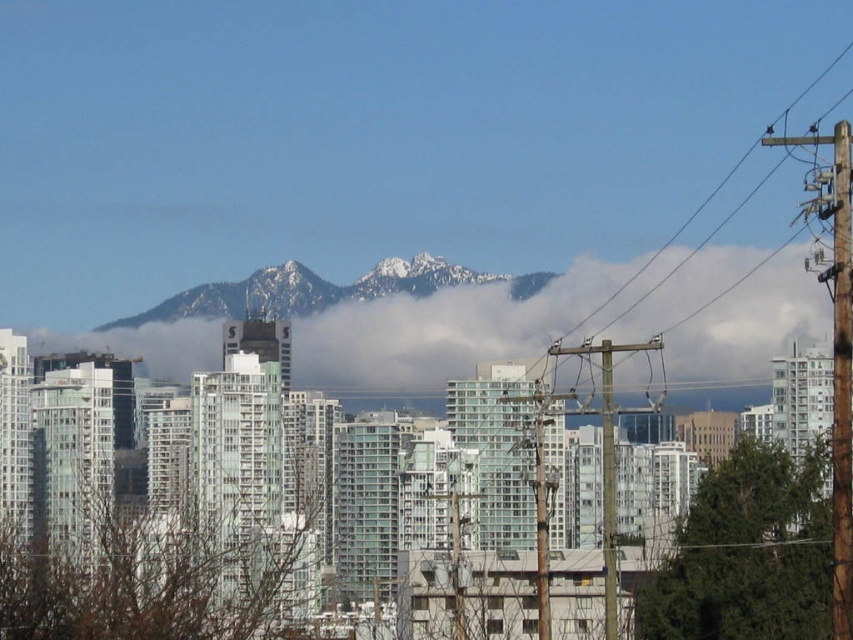
You are an architect designing a new skyscraper in this city. You want to ensure that the building doesn not block the view of the snowy rocky mountain at center from the observation deck. Given that the white fluffy cloud at center is currently obscuring part of the mountain, which object would you need to consider in your design to maintain the mountain view?

You need to consider the white fluffy cloud at center because its width is larger than the snowy rocky mountain at center, so it may block more of the mountain view. To maintain the mountain view, the skyscraper should be designed in a way that avoids obstructing the area where the white fluffy cloud at center is located.

You are an architect designing a new skyscraper in this city. You need to ensure that the building won not block the view of the white fluffy cloud at center from the main observation deck. Given that the observation deck is located at point coordinates of 0.490, 0.505, can you determine if the cloud is visible from there?

The white fluffy cloud at center is located at coordinates (438, 332). The observation deck is at (430, 313). Since the cloud is positioned slightly to the right and above the observation deck, it should be visible unless obstructed by other structures. However, the description does not mention any obstructions between them, so the cloud is likely visible.

You are standing in the city and see the white fluffy cloud at center. If you have a telescope with a maximum range of 600 meters, can you see the cloud clearly through it?

The white fluffy cloud at center is 649.13 meters away, which exceeds the telescope maximum range of 600 meters. Therefore, you cannot see the cloud clearly through it.